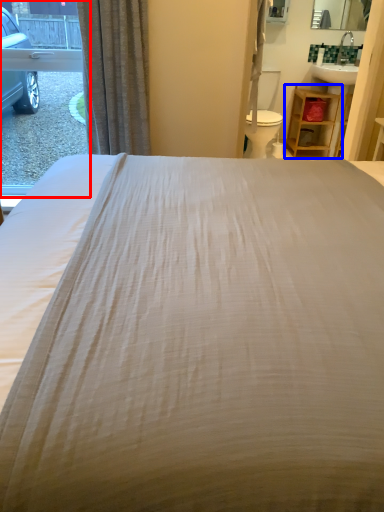
Question: Among these objects, which one is farthest to the camera, window (highlighted by a red box) or furniture (highlighted by a blue box)?

Choices:
 (A) window
 (B) furniture

Answer: (B)